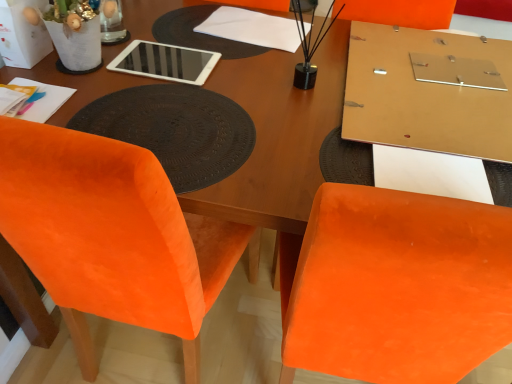
Measure the distance between white paper at center and camera.

white paper at center is 1.14 meters away from camera.

I want to click on white glossy tablet at upper center, so click(x=165, y=62).

Locate an element on the screen. The width and height of the screenshot is (512, 384). white paper bag at upper left is located at coordinates (22, 34).

Is matte gold board at upper right next to white glossy tablet at upper center and touching it?

No, matte gold board at upper right is not in contact with white glossy tablet at upper center.

Could you tell me if matte gold board at upper right is facing white glossy tablet at upper center?

No, matte gold board at upper right is not turned towards white glossy tablet at upper center.

From the image's perspective, relative to white glossy tablet at upper center, is matte gold board at upper right above or below?

matte gold board at upper right is below white glossy tablet at upper center.

Which object is thinner, white paper bag at upper left or velvet orange chair at lower left?

Thinner between the two is white paper bag at upper left.

Considering the positions of points (16, 64) and (38, 270), is point (16, 64) closer to camera compared to point (38, 270)?

No, it is behind (38, 270).

Is white paper bag at upper left further to camera compared to velvet orange chair at lower left?

Yes, it is behind velvet orange chair at lower left.

Find the location of a particular element. The width and height of the screenshot is (512, 384). box positioned vertically above the velvet orange chair at lower left (from a real-world perspective) is located at coordinates (22, 34).

Does matte gold board at upper right turn towards white paper bag at upper left?

No, matte gold board at upper right is not facing towards white paper bag at upper left.

Can you confirm if matte gold board at upper right is positioned to the left of white paper bag at upper left?

No, matte gold board at upper right is not to the left of white paper bag at upper left.

Which object is further away from the camera taking this photo, matte gold board at upper right or white paper bag at upper left?

white paper bag at upper left is behind.

Is point (307, 31) positioned before point (137, 40)?

No, (307, 31) is further to viewer.

Considering the sizes of objects white paper at center and white glossy tablet at upper center in the image provided, who is smaller, white paper at center or white glossy tablet at upper center?

white glossy tablet at upper center is smaller.

Relative to white glossy tablet at upper center, is white paper at center in front or behind?

white paper at center is positioned farther from the viewer than white glossy tablet at upper center.

From the image's perspective, would you say white paper at center is shown under white glossy tablet at upper center?

No.

Considering the positions of objects white glossy tablet at upper center and white paper bag at upper left in the image provided, who is more to the right, white glossy tablet at upper center or white paper bag at upper left?

white glossy tablet at upper center.

Is white glossy tablet at upper center oriented away from white paper bag at upper left?

No, white paper bag at upper left is not at the back of white glossy tablet at upper center.

Which is correct: white glossy tablet at upper center is inside white paper bag at upper left, or outside of it?

white glossy tablet at upper center is not enclosed by white paper bag at upper left.

Is white glossy tablet at upper center wider than white paper bag at upper left?

Indeed, white glossy tablet at upper center has a greater width compared to white paper bag at upper left.

Is white paper bag at upper left aimed at white paper at center?

No, white paper bag at upper left is not facing towards white paper at center.

Can you confirm if white paper bag at upper left is thinner than white paper at center?

Yes.

Between white paper bag at upper left and white paper at center, which one has smaller size?

Smaller between the two is white paper at center.

From a real-world perspective, is white paper bag at upper left on top of white paper at center?

Yes, from a real-world perspective, white paper bag at upper left is on top of white paper at center.

From a real-world perspective, between brown textured placemat at center and white paper bag at upper left, who is vertically higher?

From a 3D spatial view, white paper bag at upper left is above.

From the picture: Is brown textured placemat at center facing away from white paper bag at upper left?

No, white paper bag at upper left is not at the back of brown textured placemat at center.

Can you confirm if brown textured placemat at center is thinner than white paper bag at upper left?

Incorrect, the width of brown textured placemat at center is not less than that of white paper bag at upper left.

In the image, there is a matte gold board at upper right. Identify the location of tablet computer above it (from the image's perspective). (165, 62).

Where is `box on the left of velvet orange chair at lower left`? The width and height of the screenshot is (512, 384). box on the left of velvet orange chair at lower left is located at coordinates (22, 34).

Which object lies further to the anchor point white glossy tablet at upper center, velvet orange chair at lower left or white paper bag at upper left?

velvet orange chair at lower left is further to white glossy tablet at upper center.

Which object lies nearer to the anchor point velvet orange chair at lower left, white paper bag at upper left or white paper at center?

Among the two, white paper bag at upper left is located nearer to velvet orange chair at lower left.

Estimate the real-world distances between objects in this image. Which object is closer to brown textured placemat at center, white paper bag at upper left or white paper at center?

white paper bag at upper left lies closer to brown textured placemat at center than the other object.

When comparing their distances from white paper at center, does brown textured placemat at center or velvet orange chair at lower left seem further?

velvet orange chair at lower left is further to white paper at center.

Estimate the real-world distances between objects in this image. Which object is further from white paper at center, velvet orange chair at lower left or white glossy tablet at upper center?

velvet orange chair at lower left is further to white paper at center.

Considering their positions, is velvet orange chair at lower left positioned closer to white paper bag at upper left than white paper at center?

Based on the image, white paper at center appears to be nearer to white paper bag at upper left.

Based on the photo, from the image, which object appears to be nearer to white glossy tablet at upper center, white paper bag at upper left or brown textured placemat at center?

brown textured placemat at center is positioned closer to the anchor white glossy tablet at upper center.

Considering their positions, is white paper bag at upper left positioned further to brown textured placemat at center than velvet orange chair at lower left?

Among the two, white paper bag at upper left is located further to brown textured placemat at center.

You are a GUI agent. You are given a task and a screenshot of the screen. Output one action in this format:
    pyautogui.click(x=<x>, y=<y>)
    Task: Click on the notepad located between white glossy tablet at upper center and matte gold board at upper right in the left-right direction
    
    Given the screenshot: What is the action you would take?
    point(252,28)

This screenshot has width=512, height=384. What are the coordinates of `tablet computer between velvet orange chair at lower left and white paper at center along the z-axis` in the screenshot? It's located at (165, 62).

At what (x,y) coordinates should I click in order to perform the action: click on mat that lies between white paper bag at upper left and velvet orange chair at lower left from top to bottom. Please return your answer as a coordinate pair (x, y). This screenshot has width=512, height=384. Looking at the image, I should click on (175, 130).

This screenshot has height=384, width=512. I want to click on notepad between brown textured placemat at center and matte gold board at upper right from left to right, so click(252, 28).